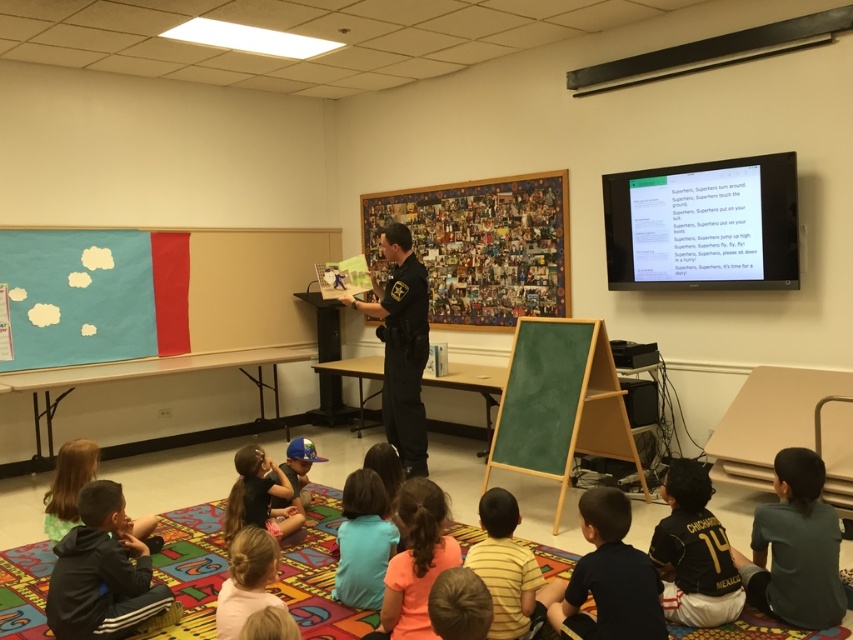
You are a GUI agent. You are given a task and a screenshot of the screen. Output one action in this format:
    pyautogui.click(x=<x>, y=<y>)
    Task: Click on the dark gray shirt at lower right
    The image size is (853, 640).
    Given the screenshot: What is the action you would take?
    pyautogui.click(x=795, y=547)

Is point (804, 595) behind point (380, 596)?

No, (804, 595) is closer to viewer.

Identify the location of dark gray shirt at lower right. The height and width of the screenshot is (640, 853). (795, 547).

Can you confirm if black fleece jacket at lower left is wider than blue matte baseball cap at center?

Yes, black fleece jacket at lower left is wider than blue matte baseball cap at center.

Who is shorter, black fleece jacket at lower left or blue matte baseball cap at center?

With less height is blue matte baseball cap at center.

Is point (113, 588) positioned behind point (308, 458)?

No, (113, 588) is closer to viewer.

Where is `black fleece jacket at lower left`? The image size is (853, 640). black fleece jacket at lower left is located at coordinates (102, 572).

Describe the element at coordinates (693, 552) in the screenshot. The height and width of the screenshot is (640, 853). I see `black jersey at lower right` at that location.

Based on the photo, is black jersey at lower right positioned in front of blue fabric cap at center?

Yes, black jersey at lower right is in front of blue fabric cap at center.

Which is in front, point (686, 465) or point (287, 509)?

Point (686, 465) is in front.

I want to click on black jersey at lower right, so click(x=693, y=552).